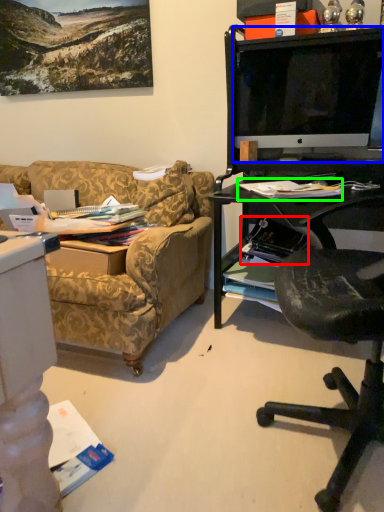
Question: Which object is positioned closest to magazine (highlighted by a red box)? Select from television (highlighted by a blue box) and magazine (highlighted by a green box).

Choices:
 (A) television
 (B) magazine

Answer: (B)